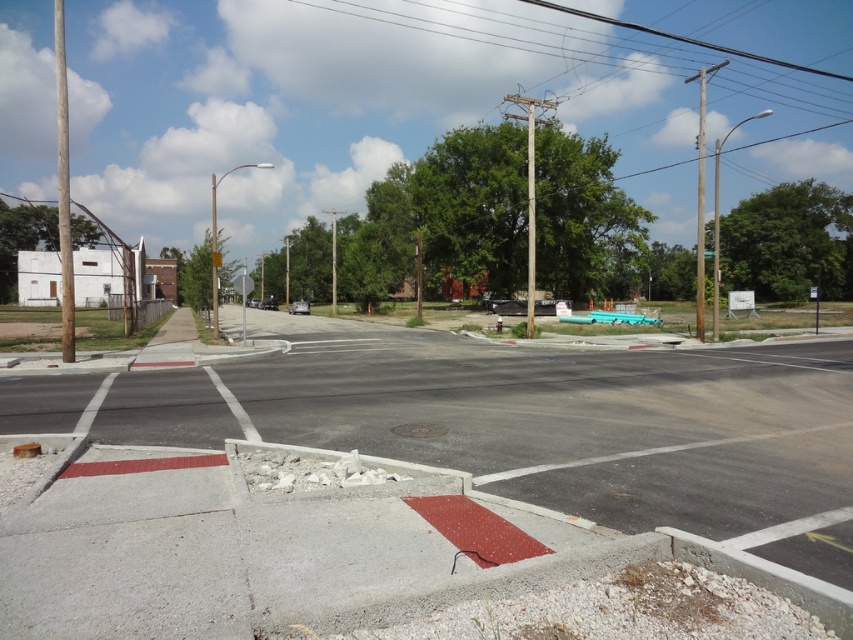
Question: Which point is farther from the camera taking this photo?

Choices:
 (A) (389, 19)
 (B) (218, 332)

Answer: (A)

Question: Can you confirm if wooden pole at left is smaller than smooth wooden pole at upper right?

Choices:
 (A) yes
 (B) no

Answer: (B)

Question: Which of these objects is positioned farthest from the metallic pole at center?

Choices:
 (A) wooden pole at left
 (B) metallic wire at upper center

Answer: (B)

Question: Is metallic wire at upper center behind smooth gray pole at center?

Choices:
 (A) no
 (B) yes

Answer: (B)

Question: Among these objects, which one is nearest to the camera?

Choices:
 (A) smooth wood pole at upper right
 (B) smooth wooden pole at upper right

Answer: (A)

Question: Does wooden pole at left have a greater width compared to metallic pole at center?

Choices:
 (A) no
 (B) yes

Answer: (B)